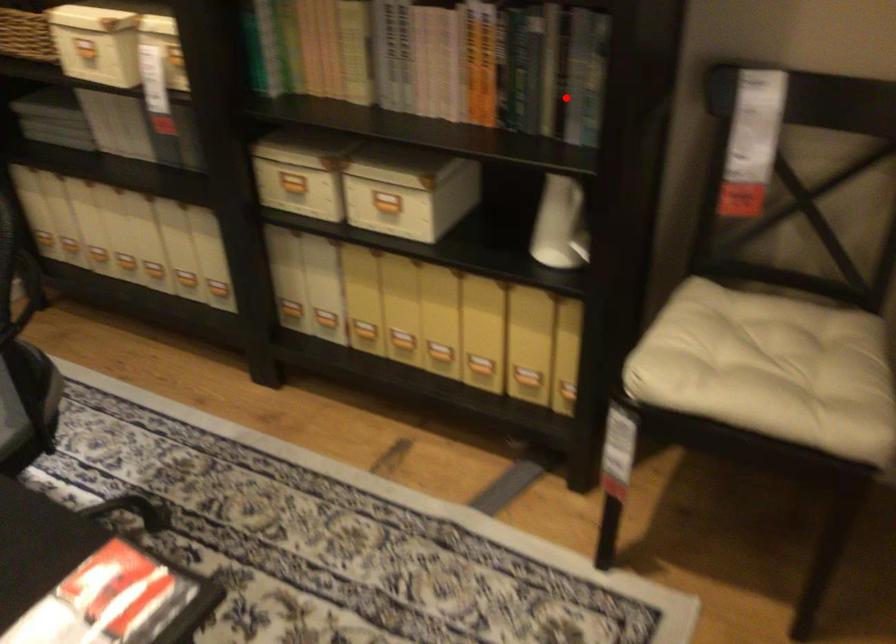
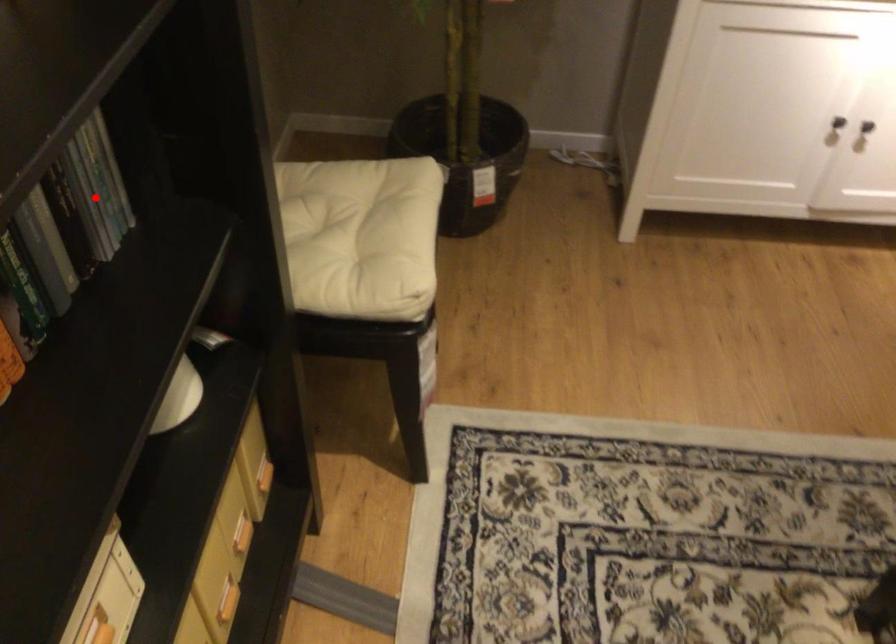
I am providing you with two images of the same scene from different viewpoints. A red point is marked on the first image and another point is marked on the second image. Are the points marked in image1 and image2 representing the same 3D position?

No